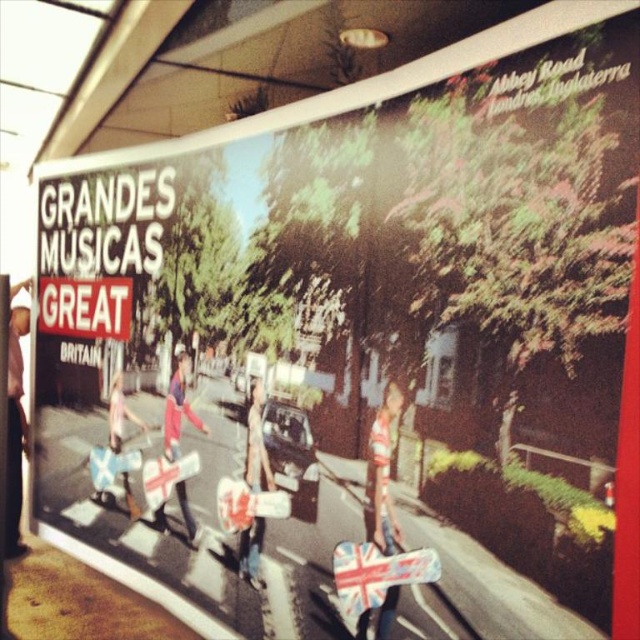
Question: Which of these objects is positioned farthest from the striped jersey at center?

Choices:
 (A) reddish-pink fabric guitar at center
 (B) white paper sign at upper left
 (C) reddish-pink fabric guitar at lower left

Answer: (B)

Question: Does white paper sign at upper left appear over denim jacket at center?

Choices:
 (A) yes
 (B) no

Answer: (A)

Question: Does matte black pants at left have a greater width compared to denim jacket at center?

Choices:
 (A) yes
 (B) no

Answer: (A)

Question: Which point is farther to the camera?

Choices:
 (A) reddish-pink fabric guitar at center
 (B) reddish-pink fabric guitar at lower left
 (C) denim jacket at center
 (D) striped jersey at center

Answer: (B)

Question: Does matte black pants at left have a greater width compared to reddish-pink fabric guitar at center?

Choices:
 (A) yes
 (B) no

Answer: (B)

Question: Among these points, which one is nearest to the camera?

Choices:
 (A) (372, 481)
 (B) (260, 449)
 (C) (22, 438)
 (D) (179, 420)

Answer: (A)